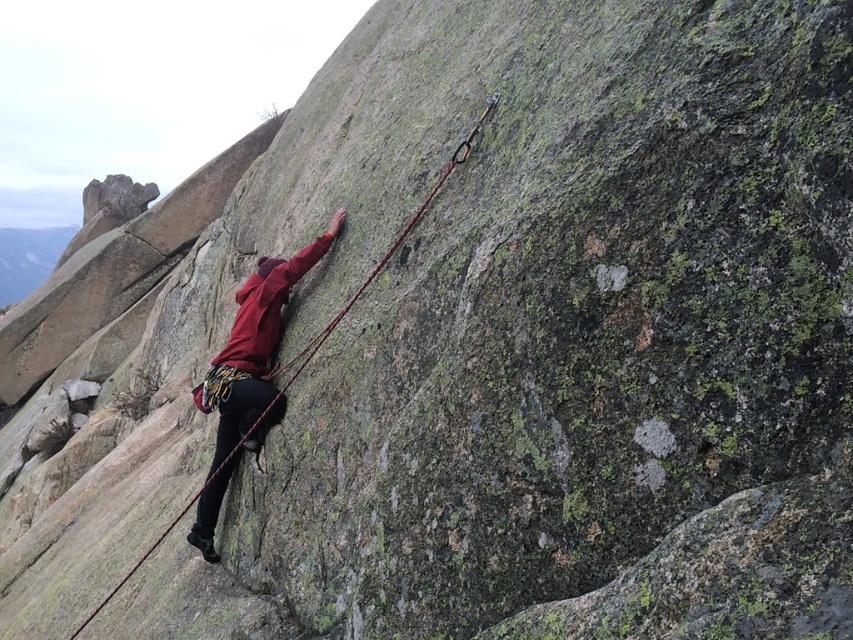
Does matte red jacket at center have a smaller size compared to red nylon rope at center?

Yes, matte red jacket at center is smaller than red nylon rope at center.

Can you confirm if matte red jacket at center is bigger than red nylon rope at center?

No.

The height and width of the screenshot is (640, 853). What are the coordinates of `matte red jacket at center` in the screenshot? It's located at click(x=247, y=371).

You are a GUI agent. You are given a task and a screenshot of the screen. Output one action in this format:
    pyautogui.click(x=<x>, y=<y>)
    Task: Click on the matte red jacket at center
    The width and height of the screenshot is (853, 640).
    Given the screenshot: What is the action you would take?
    pyautogui.click(x=247, y=371)